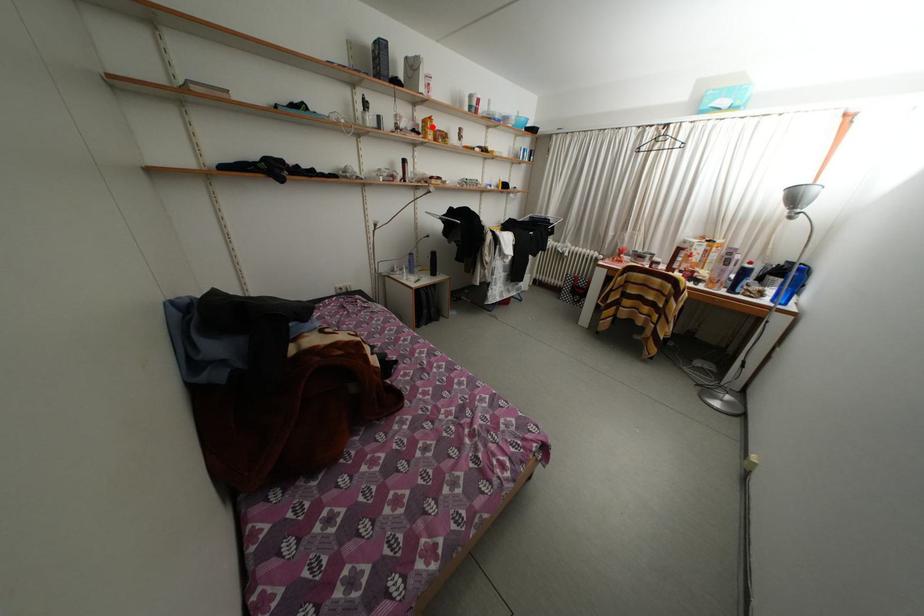
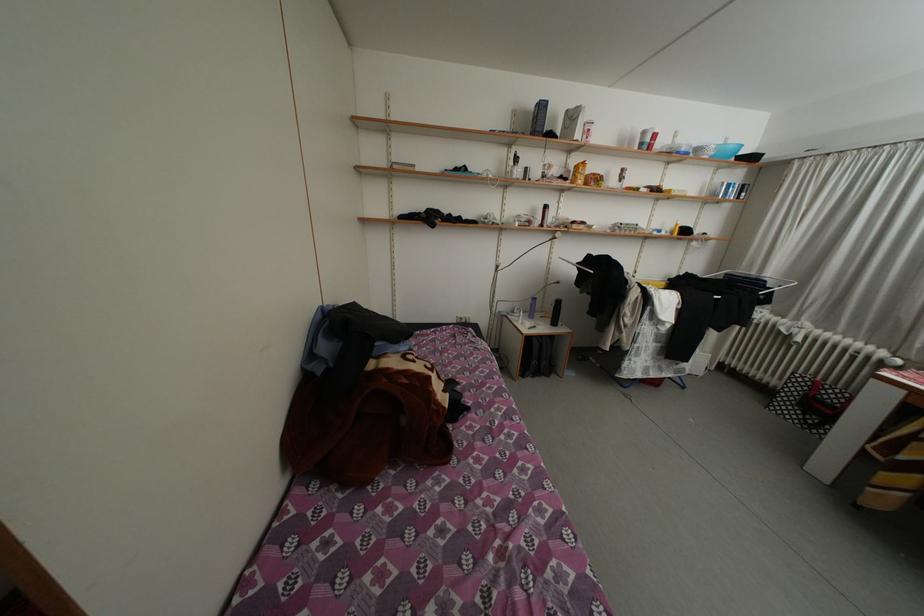
The point at the highlighted location is marked in the first image. Where is the corresponding point in the second image?

(584, 172)